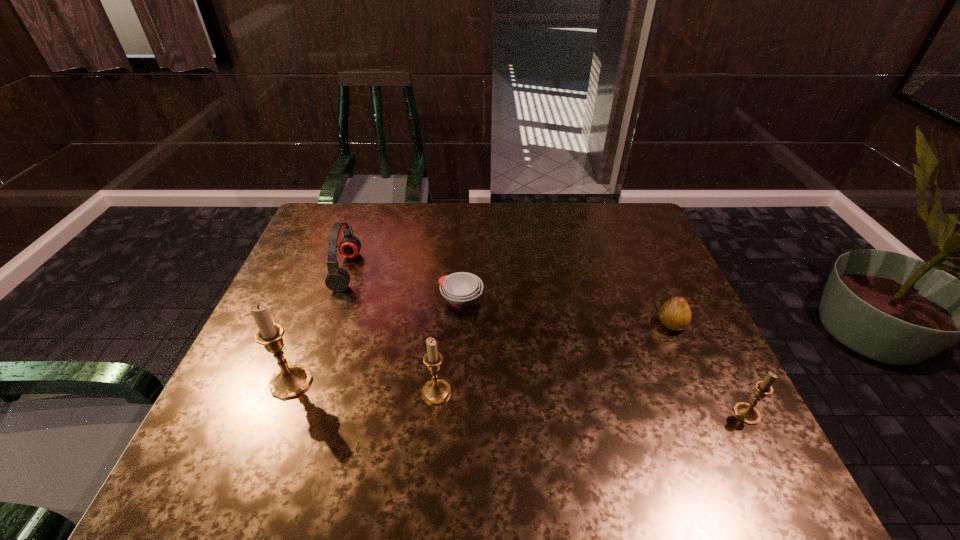
Locate an element on the screen. Image resolution: width=960 pixels, height=540 pixels. free spot located 0.120m on the back of the second shortest candle holder is located at coordinates (441, 340).

Where is `free location located 0.160m on the left of the rightmost candle holder`? The image size is (960, 540). free location located 0.160m on the left of the rightmost candle holder is located at coordinates (660, 414).

Find the location of `vacant region located 0.400m on the back of the second shortest object`. vacant region located 0.400m on the back of the second shortest object is located at coordinates (629, 227).

What are the coordinates of `vacant space located on the right of the soup bowl` in the screenshot? It's located at (564, 300).

Find the location of a particular element. free location located on the ear cups of the earphone is located at coordinates (445, 272).

You are a GUI agent. You are given a task and a screenshot of the screen. Output one action in this format:
    pyautogui.click(x=<x>, y=<y>)
    Task: Click on the candle holder located in the left edge section of the desktop
    The image size is (960, 540).
    Given the screenshot: What is the action you would take?
    pyautogui.click(x=290, y=381)

At what (x,y) coordinates should I click in order to perform the action: click on earphone situated at the left edge. Please return your answer as a coordinate pair (x, y). This screenshot has height=540, width=960. Looking at the image, I should click on (337, 280).

The width and height of the screenshot is (960, 540). In order to click on candle holder positioned at the right edge in this screenshot , I will do `click(747, 413)`.

The width and height of the screenshot is (960, 540). I want to click on pear that is positioned at the right edge, so click(675, 314).

Locate an element on the screen. object positioned at the near left corner is located at coordinates (290, 381).